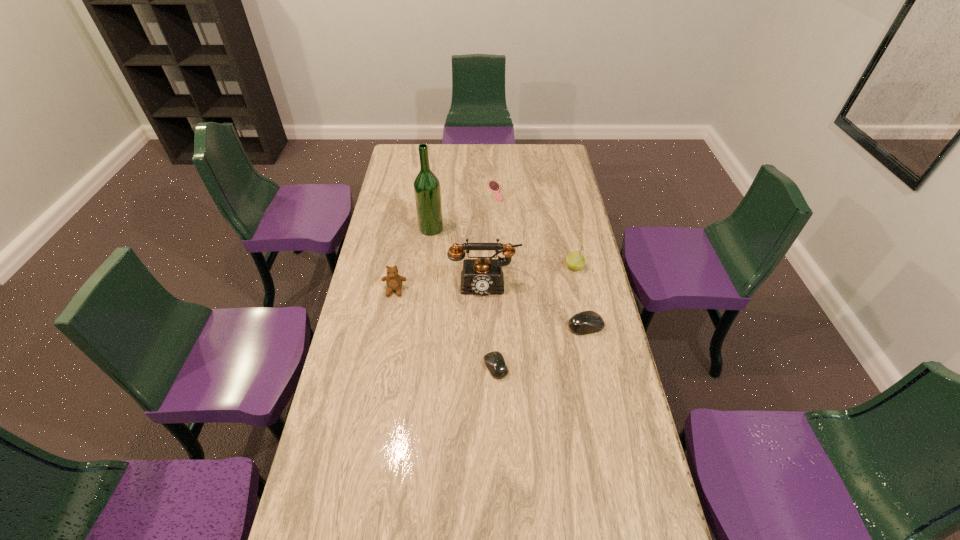
The width and height of the screenshot is (960, 540). In order to click on pear located at the right edge in this screenshot , I will do `click(575, 260)`.

In the image, there is a desktop. In order to click on vacant space at the far edge in this screenshot , I will do `click(468, 163)`.

Where is `free location at the near edge`? The image size is (960, 540). free location at the near edge is located at coordinates coord(420,504).

The image size is (960, 540). In the image, there is a desktop. Identify the location of free space at the left edge. (396, 227).

Where is `vacant space at the right edge of the desktop`? The height and width of the screenshot is (540, 960). vacant space at the right edge of the desktop is located at coordinates (549, 195).

In order to click on vacant region at the far right corner of the desktop in this screenshot , I will do `click(555, 151)`.

What are the coordinates of `vacant space in between the telephone and the farthest object` in the screenshot? It's located at (490, 236).

Where is `vacant point located between the nearer mouse and the sixth shortest object`? This screenshot has height=540, width=960. vacant point located between the nearer mouse and the sixth shortest object is located at coordinates (491, 323).

The width and height of the screenshot is (960, 540). Find the location of `vacant space that is in between the leftmost object and the right mouse`. vacant space that is in between the leftmost object and the right mouse is located at coordinates (491, 308).

You are a GUI agent. You are given a task and a screenshot of the screen. Output one action in this format:
    pyautogui.click(x=<x>, y=<y>)
    Task: Click on the free spot between the hairbrush and the third shortest object
    The height and width of the screenshot is (540, 960).
    Given the screenshot: What is the action you would take?
    pyautogui.click(x=540, y=259)